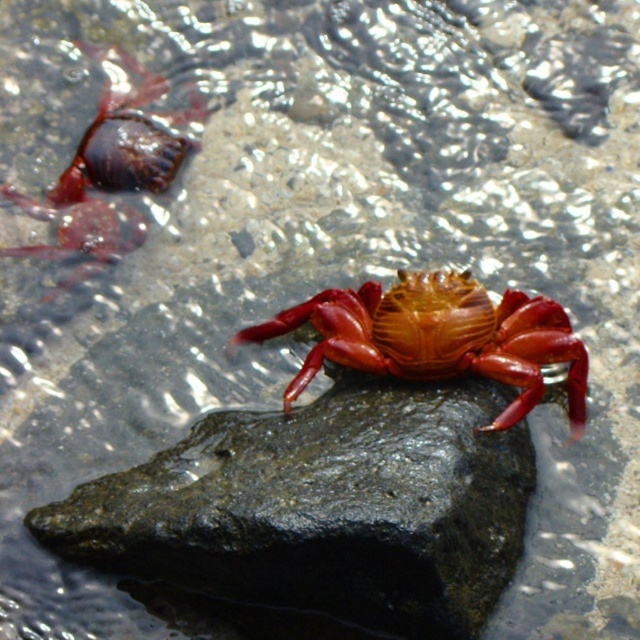
Is shiny red crab at center positioned before matte red crab at upper left?

That is True.

Image resolution: width=640 pixels, height=640 pixels. Identify the location of shiny red crab at center. (436, 337).

Does black smooth rock at center appear over shiny red crab at center?

No.

Does black smooth rock at center come in front of shiny red crab at center?

Yes, it is in front of shiny red crab at center.

Does point (483, 483) come closer to viewer compared to point (436, 352)?

Yes, point (483, 483) is closer to viewer.

At what (x,y) coordinates should I click in order to perform the action: click on black smooth rock at center. Please return your answer as a coordinate pair (x, y). The height and width of the screenshot is (640, 640). Looking at the image, I should click on (323, 508).

The image size is (640, 640). Identify the location of black smooth rock at center. (323, 508).

Is black smooth rock at center behind matte red crab at upper left?

No, black smooth rock at center is in front of matte red crab at upper left.

Between point (480, 572) and point (106, 177), which one is positioned in front?

Positioned in front is point (480, 572).

Locate an element on the screen. black smooth rock at center is located at coordinates coord(323,508).